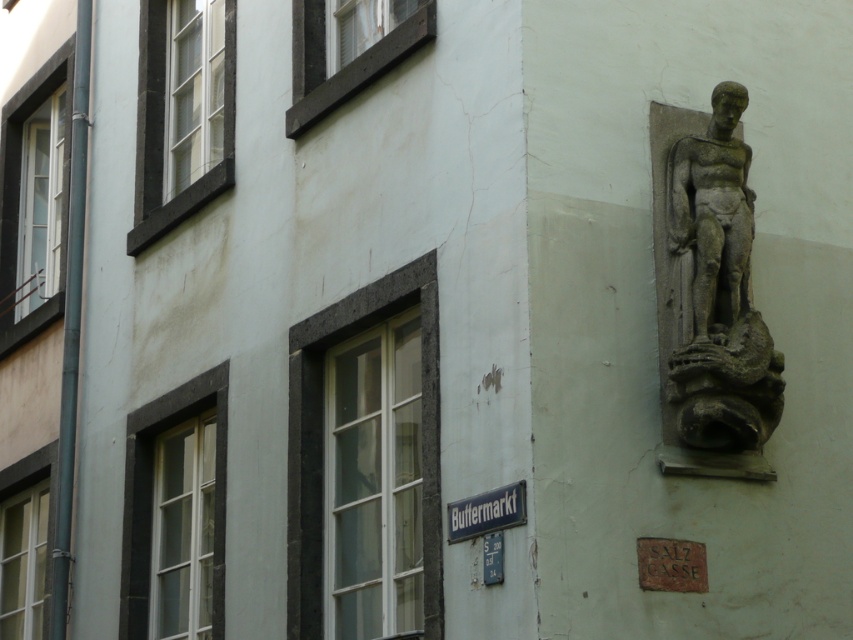
Based on the photo, can you confirm if gray stone statue at upper right is thinner than metallic blue street sign at center?

No.

Is point (691, 426) behind point (474, 522)?

Yes.

What do you see at coordinates (709, 296) in the screenshot? This screenshot has height=640, width=853. I see `gray stone statue at upper right` at bounding box center [709, 296].

Image resolution: width=853 pixels, height=640 pixels. What are the coordinates of `gray stone statue at upper right` in the screenshot? It's located at (709, 296).